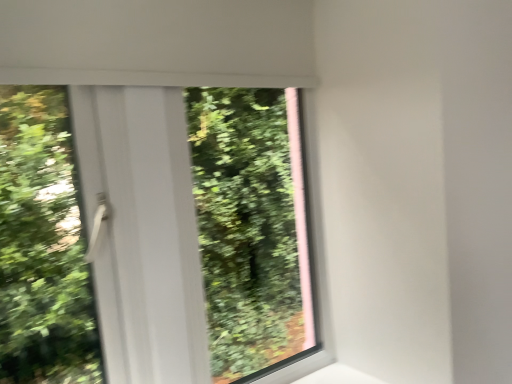
Locate an element on the screen. This screenshot has width=512, height=384. white plastic window at center is located at coordinates (153, 235).

Describe the element at coordinates (153, 235) in the screenshot. I see `white plastic window at center` at that location.

Identify the location of white plastic window at center. (153, 235).